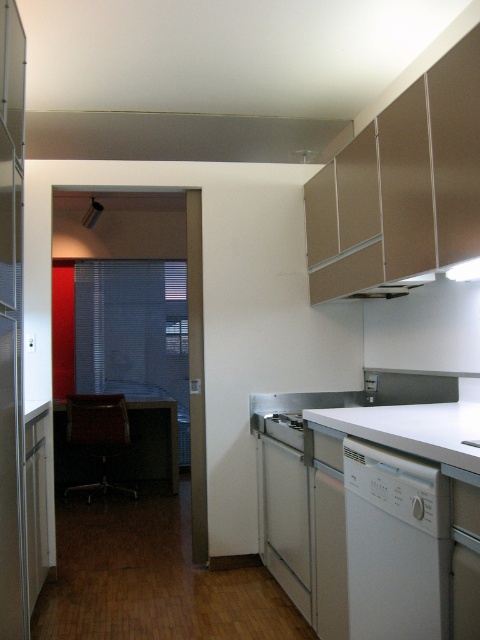
Question: Does white matte countertop at lower right have a lesser width compared to white glossy stove at lower center?

Choices:
 (A) no
 (B) yes

Answer: (A)

Question: Which object appears farthest from the camera in this image?

Choices:
 (A) white matte countertop at lower right
 (B) white matte dishwasher at lower right

Answer: (B)

Question: Which object appears farthest from the camera in this image?

Choices:
 (A) white glossy stove at lower center
 (B) white matte countertop at lower right
 (C) white matte dishwasher at lower right

Answer: (A)

Question: Is white matte dishwasher at lower right further to camera compared to white glossy stove at lower center?

Choices:
 (A) no
 (B) yes

Answer: (A)

Question: Does white matte dishwasher at lower right appear over white matte countertop at lower right?

Choices:
 (A) yes
 (B) no

Answer: (B)

Question: Estimate the real-world distances between objects in this image. Which object is closer to the white matte countertop at lower right?

Choices:
 (A) white glossy stove at lower center
 (B) white matte dishwasher at lower right

Answer: (B)